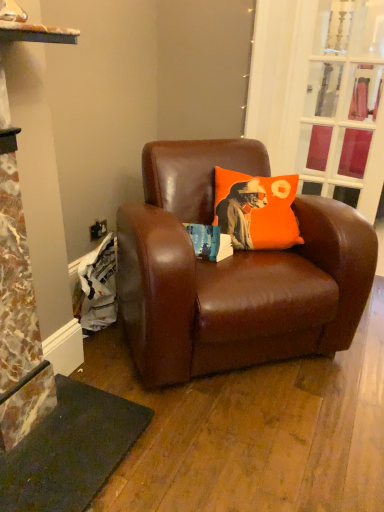
Identify the location of orange fabric pillow at center. The image size is (384, 512). (256, 210).

Which point is more forward, (339, 184) or (238, 231)?

Positioned in front is point (238, 231).

In terms of size, does clear glass door at upper right appear bigger or smaller than orange fabric pillow at center?

In the image, clear glass door at upper right appears to be smaller than orange fabric pillow at center.

The width and height of the screenshot is (384, 512). Find the location of `glass door located behind the orange fabric pillow at center`. glass door located behind the orange fabric pillow at center is located at coordinates click(x=337, y=103).

Which is more to the left, clear glass door at upper right or orange fabric pillow at center?

From the viewer's perspective, orange fabric pillow at center appears more on the left side.

Could you tell me if brown leather chair at center is turned towards clear glass door at upper right?

No, brown leather chair at center is not facing towards clear glass door at upper right.

Can you confirm if brown leather chair at center is wider than clear glass door at upper right?

Yes, brown leather chair at center is wider than clear glass door at upper right.

Would you consider brown leather chair at center to be distant from clear glass door at upper right?

That's right, there is a large distance between brown leather chair at center and clear glass door at upper right.

Is brown leather chair at center smaller than clear glass door at upper right?

Actually, brown leather chair at center might be larger than clear glass door at upper right.

From a real-world perspective, is orange fabric pillow at center positioned above or below clear glass door at upper right?

orange fabric pillow at center is below clear glass door at upper right.

From the picture: Is orange fabric pillow at center outside of clear glass door at upper right?

That's correct, orange fabric pillow at center is outside of clear glass door at upper right.

Considering the relative positions of orange fabric pillow at center and clear glass door at upper right in the image provided, is orange fabric pillow at center behind clear glass door at upper right?

No, orange fabric pillow at center is in front of clear glass door at upper right.

From the image's perspective, is orange fabric pillow at center located above clear glass door at upper right?

Incorrect, from the image's perspective, orange fabric pillow at center is lower than clear glass door at upper right.

Which of these two, clear glass door at upper right or brown leather chair at center, is bigger?

With larger size is brown leather chair at center.

Is clear glass door at upper right inside the boundaries of brown leather chair at center, or outside?

clear glass door at upper right lies outside brown leather chair at center.

From a real-world perspective, between clear glass door at upper right and brown leather chair at center, who is vertically lower?

brown leather chair at center, from a real-world perspective.

From the image's perspective, which is below, clear glass door at upper right or brown leather chair at center?

brown leather chair at center, from the image's perspective.

Which object is thinner, orange fabric pillow at center or brown leather chair at center?

orange fabric pillow at center is thinner.

Can you tell me how much orange fabric pillow at center and brown leather chair at center differ in facing direction?

30.5 degrees.

Which object is positioned more to the right, orange fabric pillow at center or brown leather chair at center?

orange fabric pillow at center is more to the right.

Measure the distance between orange fabric pillow at center and brown leather chair at center.

A distance of 10.31 inches exists between orange fabric pillow at center and brown leather chair at center.

Locate an element on the screen. The width and height of the screenshot is (384, 512). studio couch located on the left of orange fabric pillow at center is located at coordinates 233,272.

From a real-world perspective, is brown leather chair at center beneath orange fabric pillow at center?

Yes, from a real-world perspective, brown leather chair at center is under orange fabric pillow at center.

Which is less distant, (176, 247) or (290, 240)?

The point (176, 247) is more forward.

Locate an element on the screen. The image size is (384, 512). pillow that appears below the clear glass door at upper right (from a real-world perspective) is located at coordinates (256, 210).

Where is `glass door that is above the brown leather chair at center (from a real-world perspective)`? glass door that is above the brown leather chair at center (from a real-world perspective) is located at coordinates (337, 103).

Looking at this image, from the image, which object appears to be farther from clear glass door at upper right, orange fabric pillow at center or brown leather chair at center?

brown leather chair at center is positioned further to the anchor clear glass door at upper right.

From the image, which object appears to be farther from orange fabric pillow at center, clear glass door at upper right or brown leather chair at center?

clear glass door at upper right is further to orange fabric pillow at center.

Looking at the image, which one is located further to brown leather chair at center, orange fabric pillow at center or clear glass door at upper right?

clear glass door at upper right lies further to brown leather chair at center than the other object.

Which object lies further to the anchor point orange fabric pillow at center, brown leather chair at center or clear glass door at upper right?

Based on the image, clear glass door at upper right appears to be further to orange fabric pillow at center.

When comparing their distances from clear glass door at upper right, does brown leather chair at center or orange fabric pillow at center seem closer?

The object closer to clear glass door at upper right is orange fabric pillow at center.

Consider the image. From the image, which object appears to be nearer to brown leather chair at center, clear glass door at upper right or orange fabric pillow at center?

orange fabric pillow at center lies closer to brown leather chair at center than the other object.

This screenshot has height=512, width=384. I want to click on pillow located between brown leather chair at center and clear glass door at upper right in the depth direction, so click(x=256, y=210).